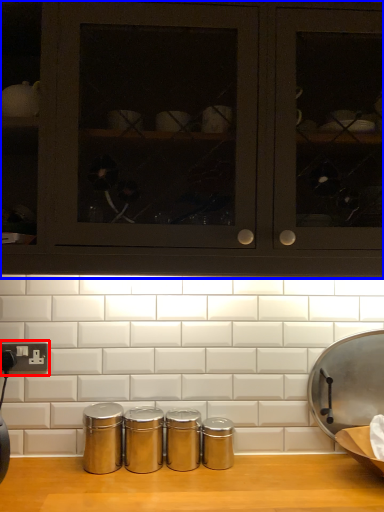
Question: Which of the following is the farthest to the observer, electric outlet (highlighted by a red box) or cabinetry (highlighted by a blue box)?

Choices:
 (A) electric outlet
 (B) cabinetry

Answer: (A)